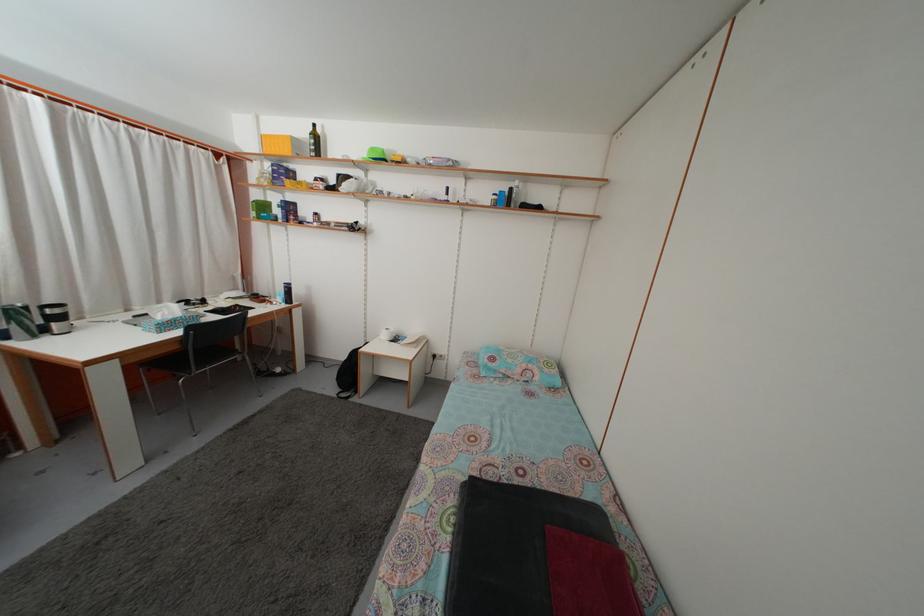
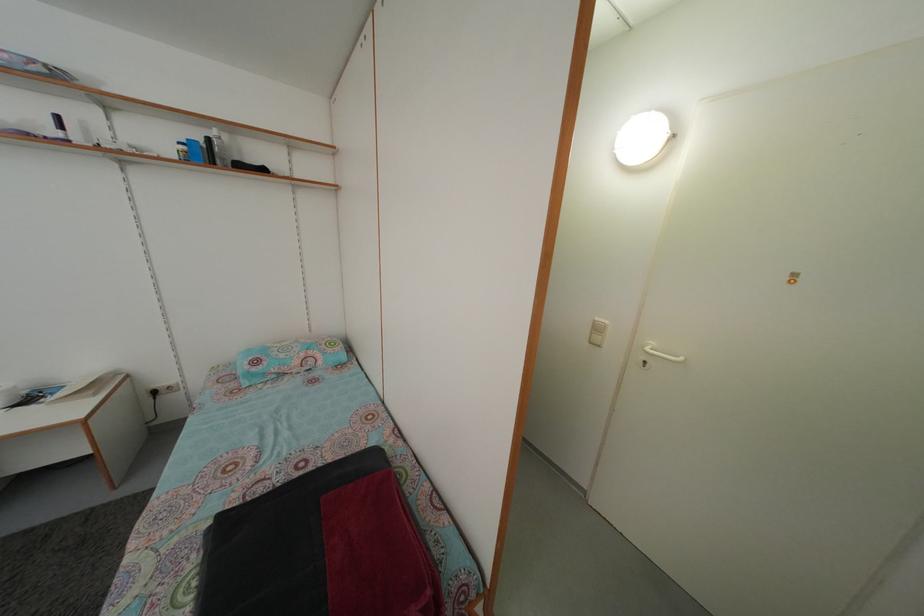
The point at (517, 197) is marked in the first image. Where is the corresponding point in the second image?

(214, 148)